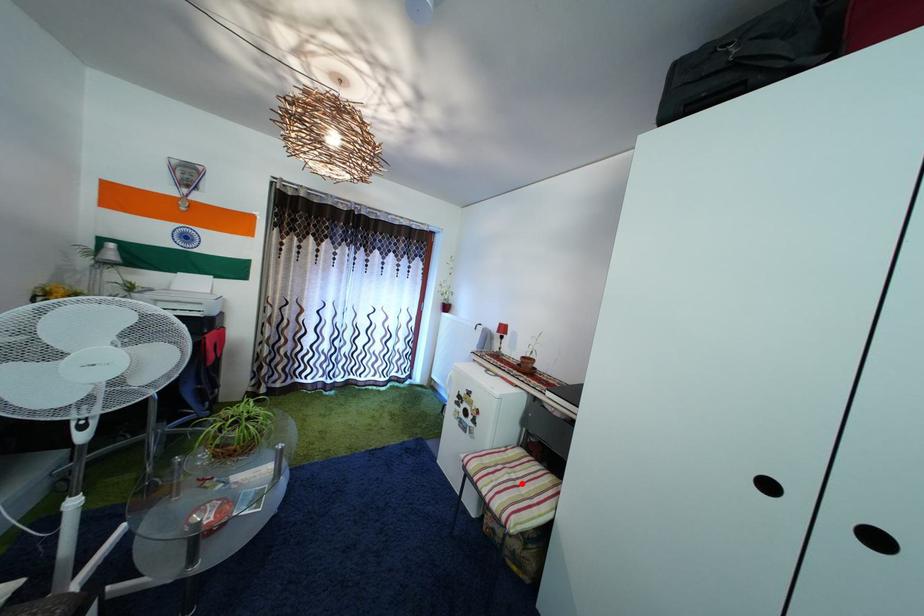
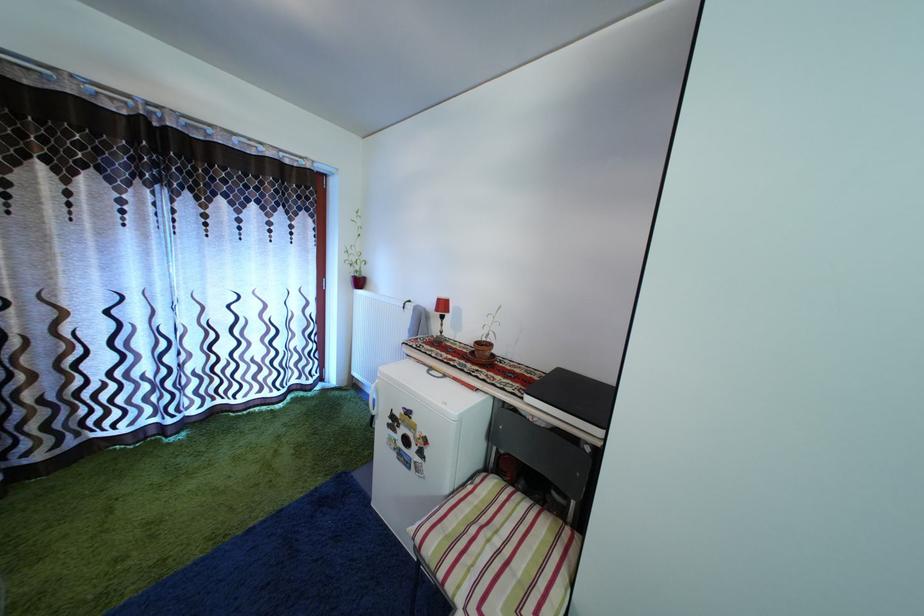
In the second image, find the point that corresponds to the highlighted location in the first image.

(505, 549)